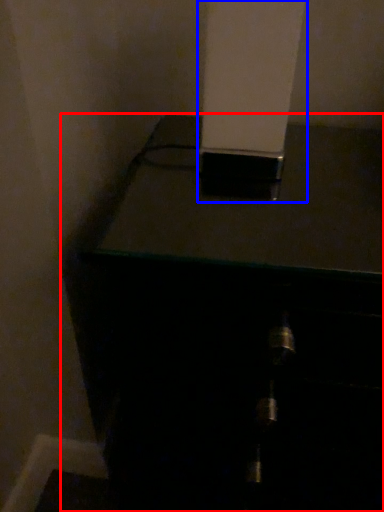
Question: Which point is further to the camera, furniture (highlighted by a red box) or pillar (highlighted by a blue box)?

Choices:
 (A) furniture
 (B) pillar

Answer: (A)